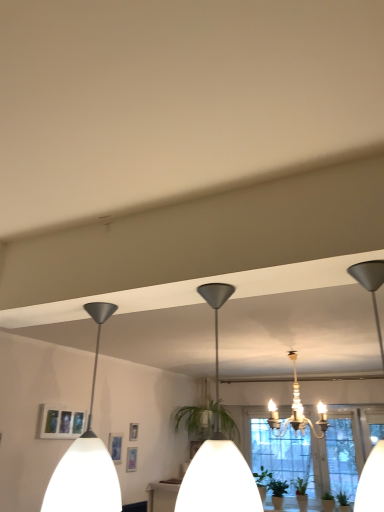
Identify the location of matte black pendant light at center, which is the 2th lamp in left-to-right order. The height and width of the screenshot is (512, 384). (218, 452).

The width and height of the screenshot is (384, 512). What do you see at coordinates (86, 458) in the screenshot? I see `white matte pendant light at left, which is counted as the second lamp, starting from the front` at bounding box center [86, 458].

Locate an element on the screen. white crystal chandelier at center, acting as the 3th lamp starting from the front is located at coordinates (297, 411).

Is clear glass window at center outside of white matte pendant light at left, which is counted as the first lamp, starting from the left?

Yes, clear glass window at center is outside of white matte pendant light at left, which is counted as the first lamp, starting from the left.

In the scene shown: Is clear glass window at center taller or shorter than white matte pendant light at left, the second lamp when ordered from back to front?

clear glass window at center is taller than white matte pendant light at left, the second lamp when ordered from back to front.

Is clear glass window at center in front of white matte pendant light at left, which is counted as the second lamp, starting from the front?

No, clear glass window at center is further to the viewer.

Considering the positions of objects matte white picture frame at lower left and white matte pendant light at left, which is counted as the first lamp, starting from the left, in the image provided, who is more to the left, matte white picture frame at lower left or white matte pendant light at left, which is counted as the first lamp, starting from the left,?

Positioned to the left is matte white picture frame at lower left.

From a real-world perspective, is matte white picture frame at lower left above or below white matte pendant light at left, arranged as the third lamp when viewed from the right?

In terms of real-world spatial position, matte white picture frame at lower left is below white matte pendant light at left, arranged as the third lamp when viewed from the right.

The image size is (384, 512). I want to click on lamp that is the 2nd object located above the matte white picture frame at lower left (from the image's perspective), so click(x=86, y=458).

Could you tell me if matte white picture frame at lower left is facing white matte pendant light at left, which is counted as the first lamp, starting from the left?

No.

Do you think matte black pendant light at center, which is the 1th lamp in front-to-back order, is within clear glass window at center, or outside of it?

The correct answer is: outside.

Looking at the image, does matte black pendant light at center, which is the 2th lamp in left-to-right order, seem bigger or smaller compared to clear glass window at center?

Considering their sizes, matte black pendant light at center, which is the 2th lamp in left-to-right order, takes up less space than clear glass window at center.

Is the depth of matte black pendant light at center, which ranks as the second lamp in right-to-left order, greater than that of clear glass window at center?

No.

From a real-world perspective, is matte black pendant light at center, marked as the third lamp in a back-to-front arrangement, above or below clear glass window at center?

Clearly, from a real-world perspective, matte black pendant light at center, marked as the third lamp in a back-to-front arrangement, is above clear glass window at center.

From a real-world perspective, is white matte pendant light at left, which is counted as the second lamp, starting from the front, positioned over white crystal chandelier at center, acting as the 3th lamp starting from the front, based on gravity?

No.

Who is taller, white matte pendant light at left, arranged as the third lamp when viewed from the right, or white crystal chandelier at center, which is the 1th lamp in right-to-left order?

white crystal chandelier at center, which is the 1th lamp in right-to-left order, is taller.

Is white matte pendant light at left, arranged as the third lamp when viewed from the right, turned away from white crystal chandelier at center, acting as the first lamp starting from the back?

Yes, white matte pendant light at left, arranged as the third lamp when viewed from the right,'s orientation is away from white crystal chandelier at center, acting as the first lamp starting from the back.

In terms of width, does white matte pendant light at left, which is counted as the first lamp, starting from the left, look wider or thinner when compared to white crystal chandelier at center, which is the 1th lamp in right-to-left order?

In the image, white matte pendant light at left, which is counted as the first lamp, starting from the left, appears to be more narrow than white crystal chandelier at center, which is the 1th lamp in right-to-left order.

Which is more to the right, clear glass window at center or white crystal chandelier at center, acting as the 3th lamp starting from the front?

clear glass window at center is more to the right.

In terms of width, does clear glass window at center look wider or thinner when compared to white crystal chandelier at center, the third lamp in the left-to-right sequence?

clear glass window at center is thinner than white crystal chandelier at center, the third lamp in the left-to-right sequence.

Is clear glass window at center positioned with its back to white crystal chandelier at center, acting as the first lamp starting from the back?

No.

Which point is more distant from viewer, (94, 472) or (306, 444)?

Point (306, 444)

From the picture: Is white matte pendant light at left, which is counted as the second lamp, starting from the front, positioned far away from clear glass window at center?

Yes.

Is white matte pendant light at left, which is counted as the first lamp, starting from the left, thinner than clear glass window at center?

In fact, white matte pendant light at left, which is counted as the first lamp, starting from the left, might be wider than clear glass window at center.

Is white crystal chandelier at center, the third lamp in the left-to-right sequence, aimed at white matte pendant light at left, arranged as the third lamp when viewed from the right?

Yes, white crystal chandelier at center, the third lamp in the left-to-right sequence, is turned towards white matte pendant light at left, arranged as the third lamp when viewed from the right.

Considering the positions of point (276, 421) and point (75, 455), is point (276, 421) closer or farther from the camera than point (75, 455)?

Clearly, point (276, 421) is more distant from the camera than point (75, 455).

The width and height of the screenshot is (384, 512). There is a clear glass window at center. In order to click on the 2nd lamp above it (from the image's perspective) in this screenshot , I will do `click(86, 458)`.

This screenshot has height=512, width=384. In order to click on picture frame that appears on the left of white matte pendant light at left, which is counted as the first lamp, starting from the left in this screenshot , I will do `click(61, 422)`.

Based on their spatial positions, is matte black pendant light at center, marked as the third lamp in a back-to-front arrangement, or white crystal chandelier at center, the third lamp in the left-to-right sequence, further from white matte pendant light at left, arranged as the third lamp when viewed from the right?

The object further to white matte pendant light at left, arranged as the third lamp when viewed from the right, is white crystal chandelier at center, the third lamp in the left-to-right sequence.

Estimate the real-world distances between objects in this image. Which object is further from clear glass window at center, white crystal chandelier at center, acting as the 3th lamp starting from the front, or matte white picture frame at lower left?

The object further to clear glass window at center is matte white picture frame at lower left.

From the image, which object appears to be nearer to clear glass window at center, matte white picture frame at lower left or white crystal chandelier at center, acting as the 3th lamp starting from the front?

The object closer to clear glass window at center is white crystal chandelier at center, acting as the 3th lamp starting from the front.

When comparing their distances from clear glass window at center, does matte black pendant light at center, marked as the third lamp in a back-to-front arrangement, or white matte pendant light at left, which is counted as the first lamp, starting from the left, seem further?

matte black pendant light at center, marked as the third lamp in a back-to-front arrangement, lies further to clear glass window at center than the other object.

Consider the image. Which object lies further to the anchor point matte black pendant light at center, which is the 1th lamp in front-to-back order, matte white picture frame at lower left or white matte pendant light at left, which is counted as the second lamp, starting from the front?

Based on the image, matte white picture frame at lower left appears to be further to matte black pendant light at center, which is the 1th lamp in front-to-back order.

From the image, which object appears to be farther from matte black pendant light at center, which ranks as the second lamp in right-to-left order, white crystal chandelier at center, the third lamp in the left-to-right sequence, or white matte pendant light at left, arranged as the third lamp when viewed from the right?

white crystal chandelier at center, the third lamp in the left-to-right sequence, lies further to matte black pendant light at center, which ranks as the second lamp in right-to-left order, than the other object.

Based on their spatial positions, is white matte pendant light at left, which is counted as the second lamp, starting from the front, or matte white picture frame at lower left further from clear glass window at center?

white matte pendant light at left, which is counted as the second lamp, starting from the front, lies further to clear glass window at center than the other object.

Which object lies nearer to the anchor point clear glass window at center, white matte pendant light at left, the second lamp when ordered from back to front, or matte black pendant light at center, which ranks as the second lamp in right-to-left order?

white matte pendant light at left, the second lamp when ordered from back to front.

Where is `lamp between matte black pendant light at center, which is the 2th lamp in left-to-right order, and white crystal chandelier at center, acting as the first lamp starting from the back, from front to back`? This screenshot has height=512, width=384. lamp between matte black pendant light at center, which is the 2th lamp in left-to-right order, and white crystal chandelier at center, acting as the first lamp starting from the back, from front to back is located at coordinates (86, 458).

Where is `lamp between white matte pendant light at left, arranged as the third lamp when viewed from the right, and matte white picture frame at lower left, along the z-axis`? The image size is (384, 512). lamp between white matte pendant light at left, arranged as the third lamp when viewed from the right, and matte white picture frame at lower left, along the z-axis is located at coordinates (297, 411).

The height and width of the screenshot is (512, 384). In order to click on picture frame positioned between white matte pendant light at left, which is counted as the second lamp, starting from the front, and clear glass window at center from near to far in this screenshot , I will do `click(61, 422)`.

Image resolution: width=384 pixels, height=512 pixels. I want to click on picture frame between matte black pendant light at center, which is the 2th lamp in left-to-right order, and clear glass window at center from front to back, so click(x=61, y=422).